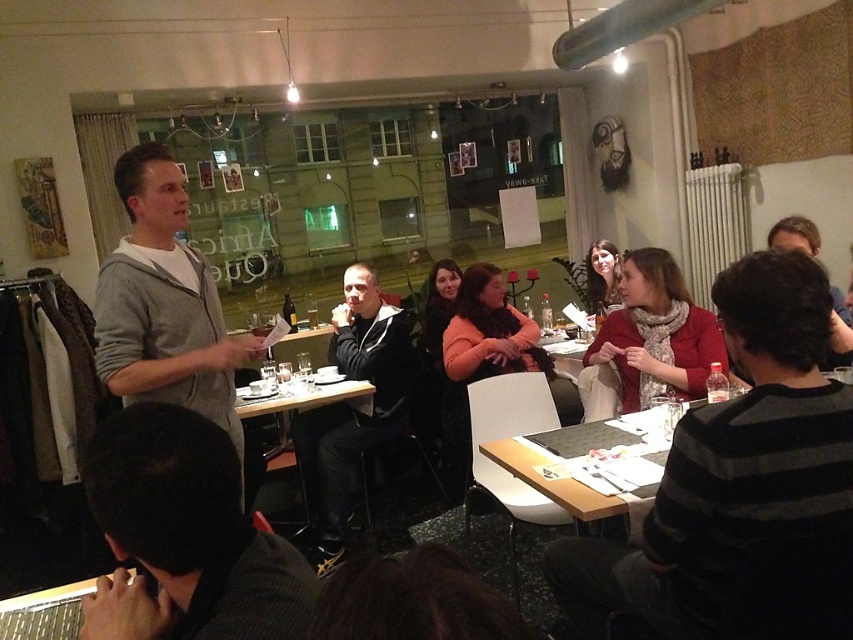
Question: Does dark gray striped shirt at lower left have a greater width compared to wooden table at lower right?

Choices:
 (A) no
 (B) yes

Answer: (A)

Question: Which point is closer to the camera?

Choices:
 (A) (666, 310)
 (B) (601, 513)
 (C) (189, 627)

Answer: (C)

Question: Which point is closer to the camera taking this photo?

Choices:
 (A) (184, 257)
 (B) (693, 352)
 (C) (490, 452)
 (D) (283, 406)

Answer: (A)

Question: Can you confirm if red scarf at center is smaller than matte red scarf at center?

Choices:
 (A) yes
 (B) no

Answer: (B)

Question: Which object is positioned closest to the dark gray striped shirt at lower left?

Choices:
 (A) gray hoodie at center
 (B) matte red scarf at center

Answer: (A)

Question: Does dark gray striped shirt at lower left have a lesser width compared to wooden table at lower right?

Choices:
 (A) no
 (B) yes

Answer: (B)